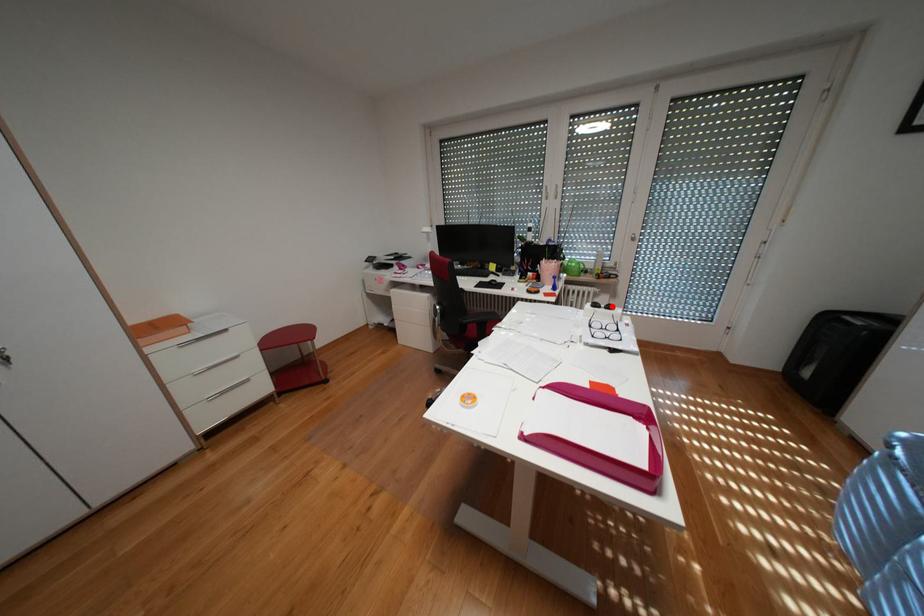
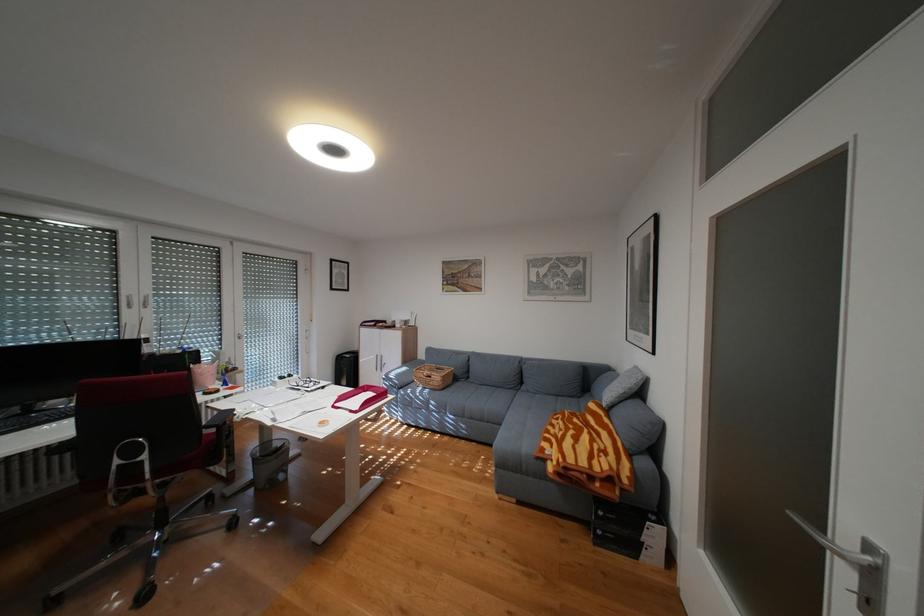
Locate, in the second image, the point that corresponds to the highlighted location in the first image.

(297, 377)